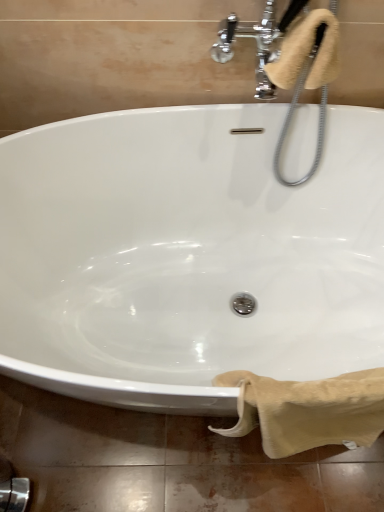
This screenshot has width=384, height=512. What are the coordinates of `vacant space underneath beige cotton towel at lower right, which is the second bath towel in top-to-bottom order (from a real-world perspective)` in the screenshot? It's located at (275, 461).